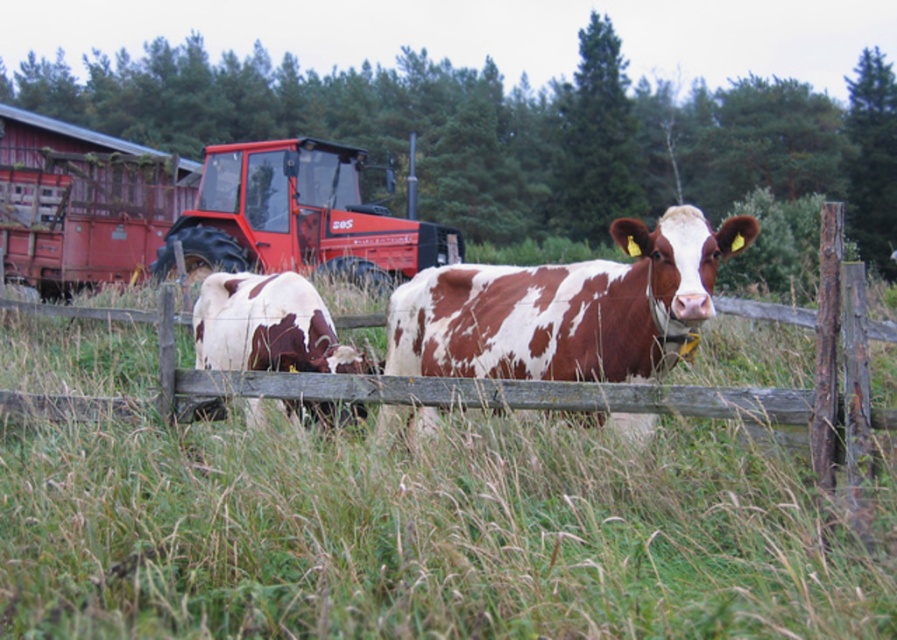
What are the coordinates of the brown and white speckled cow at center?

The coordinates of the brown and white speckled cow at center are at point (x=567, y=308).